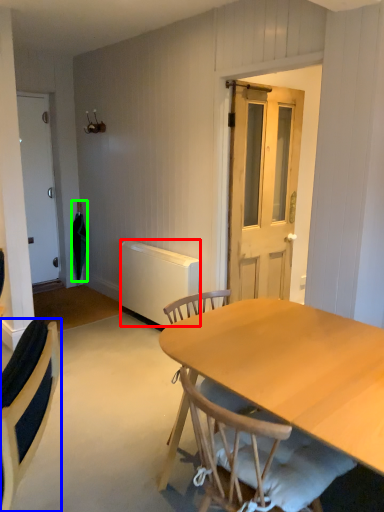
Question: Considering the real-world distances, which object is farthest from radiator (highlighted by a red box)? chair (highlighted by a blue box) or umbrella (highlighted by a green box)?

Choices:
 (A) chair
 (B) umbrella

Answer: (A)